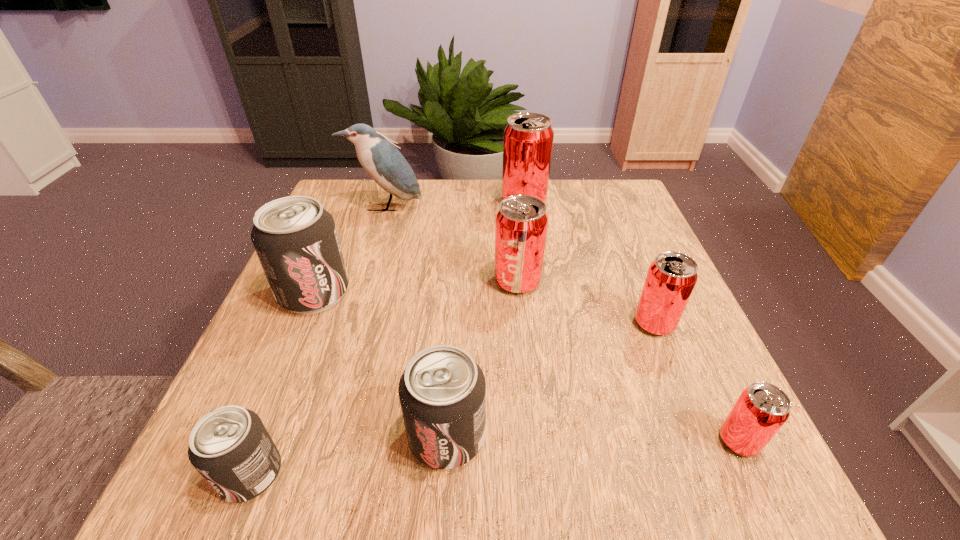
The width and height of the screenshot is (960, 540). Identify the location of free space between the fourth object from left to right and the biggest black soda can. (380, 364).

The image size is (960, 540). Identify the location of object that stands as the fifth closest to the fifth object from right to left. (761, 410).

Point out which object is positioned as the sixth nearest to the second biggest red soda can. Please provide its 2D coordinates. Your answer should be formatted as a tuple, i.e. [(x, y)], where the tuple contains the x and y coordinates of a point satisfying the conditions above.

[(761, 410)]

Find the location of a particular element. This screenshot has width=960, height=540. soda can that is the closest to the bird is located at coordinates (528, 137).

Locate which soda can is the second closest to the smallest black soda can. Please provide its 2D coordinates. Your answer should be formatted as a tuple, i.e. [(x, y)], where the tuple contains the x and y coordinates of a point satisfying the conditions above.

[(295, 238)]

Identify the location of red soda can that is the closest to the farthest soda can. Image resolution: width=960 pixels, height=540 pixels. (521, 223).

Find the location of `red soda can that is the third closest to the third nearest red soda can`. red soda can that is the third closest to the third nearest red soda can is located at coordinates (761, 410).

Identify the location of black soda can that can be found as the second closest to the biggest black soda can. This screenshot has width=960, height=540. (230, 447).

Where is `black soda can that is the nearest to the second nearest red soda can`? The image size is (960, 540). black soda can that is the nearest to the second nearest red soda can is located at coordinates (442, 391).